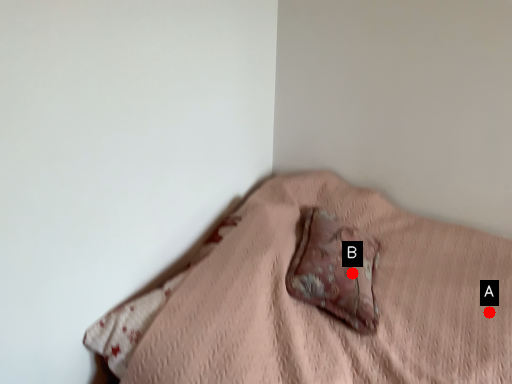
Question: Two points are circled on the image, labeled by A and B beside each circle. Which of the following is the closest to the observer?

Choices:
 (A) A is closer
 (B) B is closer

Answer: (B)